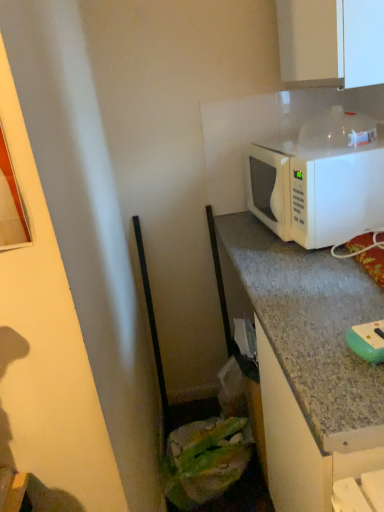
Question: Does white glossy cabinet at upper right have a greater width compared to white matte microwave at upper right?

Choices:
 (A) yes
 (B) no

Answer: (B)

Question: Does white glossy cabinet at upper right turn towards white matte microwave at upper right?

Choices:
 (A) no
 (B) yes

Answer: (A)

Question: Is white glossy cabinet at upper right with white matte microwave at upper right?

Choices:
 (A) no
 (B) yes

Answer: (A)

Question: Is white glossy cabinet at upper right positioned before white matte microwave at upper right?

Choices:
 (A) yes
 (B) no

Answer: (A)

Question: Is white glossy cabinet at upper right at the left side of white matte microwave at upper right?

Choices:
 (A) no
 (B) yes

Answer: (A)

Question: Considering their positions, is green rubber sponge at lower right located in front of or behind white glossy cabinet at upper right?

Choices:
 (A) front
 (B) behind

Answer: (A)

Question: From a real-world perspective, relative to white glossy cabinet at upper right, is green rubber sponge at lower right vertically above or below?

Choices:
 (A) above
 (B) below

Answer: (B)

Question: Is green rubber sponge at lower right taller or shorter than white glossy cabinet at upper right?

Choices:
 (A) short
 (B) tall

Answer: (A)

Question: Considering the positions of point click(x=374, y=345) and point click(x=311, y=41), is point click(x=374, y=345) closer or farther from the camera than point click(x=311, y=41)?

Choices:
 (A) farther
 (B) closer

Answer: (B)

Question: Based on their sizes in the image, would you say white glossy cabinet at upper right is bigger or smaller than green rubber sponge at lower right?

Choices:
 (A) small
 (B) big

Answer: (B)

Question: Is white glossy cabinet at upper right to the left or to the right of green rubber sponge at lower right in the image?

Choices:
 (A) left
 (B) right

Answer: (A)

Question: In terms of height, does white glossy cabinet at upper right look taller or shorter compared to green rubber sponge at lower right?

Choices:
 (A) short
 (B) tall

Answer: (B)

Question: Is white glossy cabinet at upper right in front of or behind green rubber sponge at lower right in the image?

Choices:
 (A) front
 (B) behind

Answer: (B)

Question: Choose the correct answer: Is white matte microwave at upper right inside white glossy cabinet at upper right or outside it?

Choices:
 (A) inside
 (B) outside

Answer: (B)

Question: Considering the positions of white matte microwave at upper right and white glossy cabinet at upper right in the image, is white matte microwave at upper right wider or thinner than white glossy cabinet at upper right?

Choices:
 (A) thin
 (B) wide

Answer: (B)